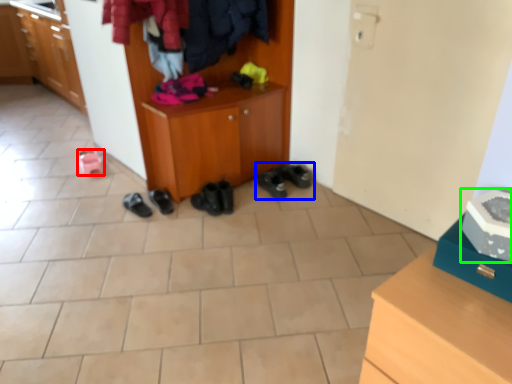
Question: Considering the real-world distances, which object is farthest from footwear (highlighted by a red box)? footwear (highlighted by a blue box) or shoe (highlighted by a green box)?

Choices:
 (A) footwear
 (B) shoe

Answer: (B)